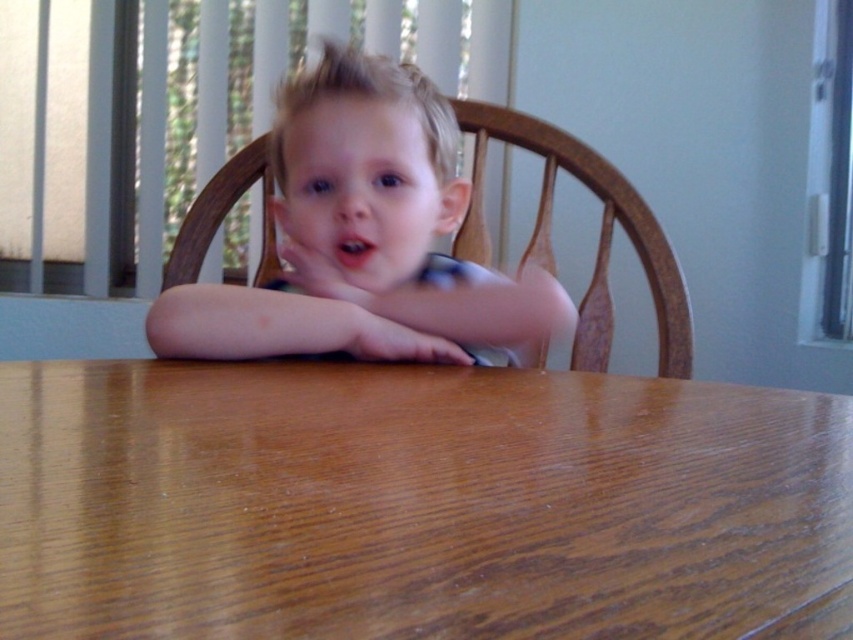
Question: Which point is closer to the camera?

Choices:
 (A) brown wood table at center
 (B) smooth blonde hair at center
 (C) smooth skin hand at center

Answer: (A)

Question: Which object is positioned farthest from the smooth blonde hair at center?

Choices:
 (A) smooth skin hand at center
 (B) brown wood table at center

Answer: (B)

Question: Can you confirm if brown wood table at center is positioned to the right of smooth skin hand at center?

Choices:
 (A) yes
 (B) no

Answer: (A)

Question: Which point is closer to the camera?

Choices:
 (A) brown wood table at center
 (B) smooth blonde hair at center
 (C) smooth skin hand at center

Answer: (A)

Question: Can you confirm if brown wood table at center is positioned to the right of smooth skin hand at center?

Choices:
 (A) yes
 (B) no

Answer: (A)

Question: Can you confirm if smooth blonde hair at center is smaller than smooth skin hand at center?

Choices:
 (A) no
 (B) yes

Answer: (A)